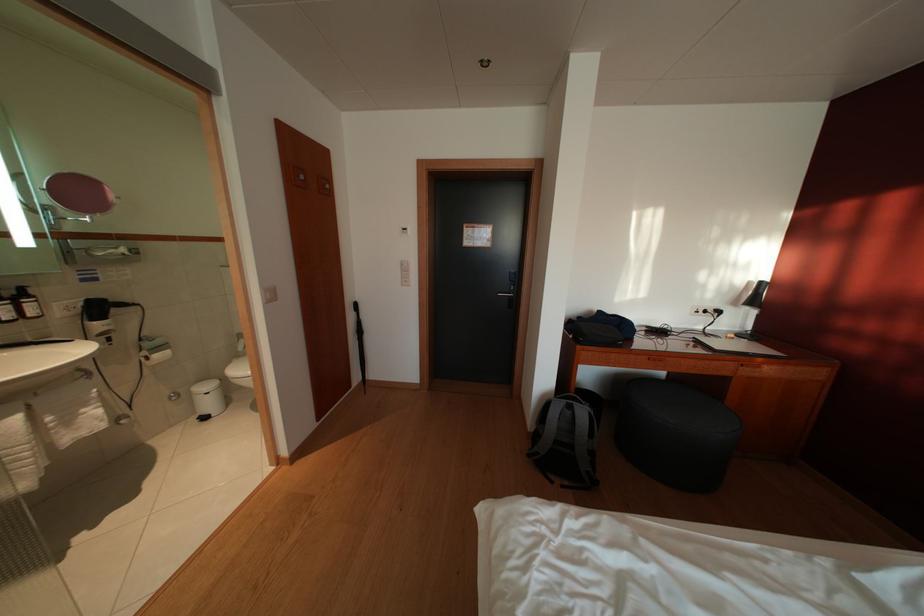
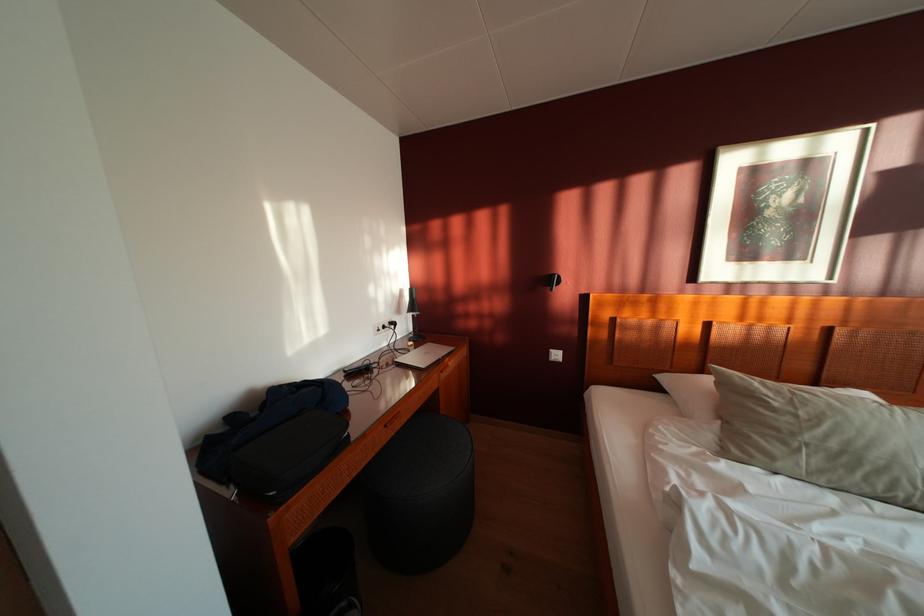
Question: The camera is either moving clockwise (left) or counter-clockwise (right) around the object. The first image is from the beginning of the video and the second image is from the end. Is the camera moving left or right when shooting the video?

Choices:
 (A) Left
 (B) Right

Answer: (A)